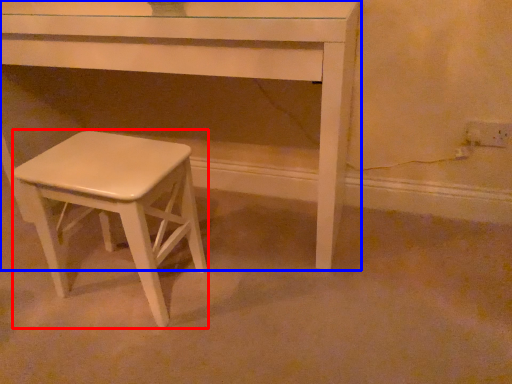
Question: Which point is closer to the camera, stool (highlighted by a red box) or table (highlighted by a blue box)?

Choices:
 (A) stool
 (B) table

Answer: (A)